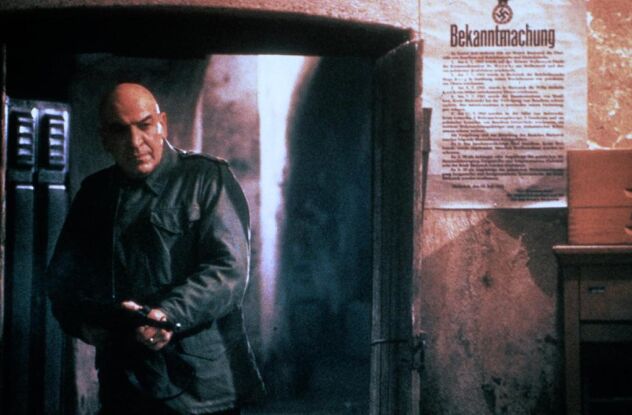
What are the coordinates of `lockers/storage` in the screenshot? It's located at (47, 174), (28, 205).